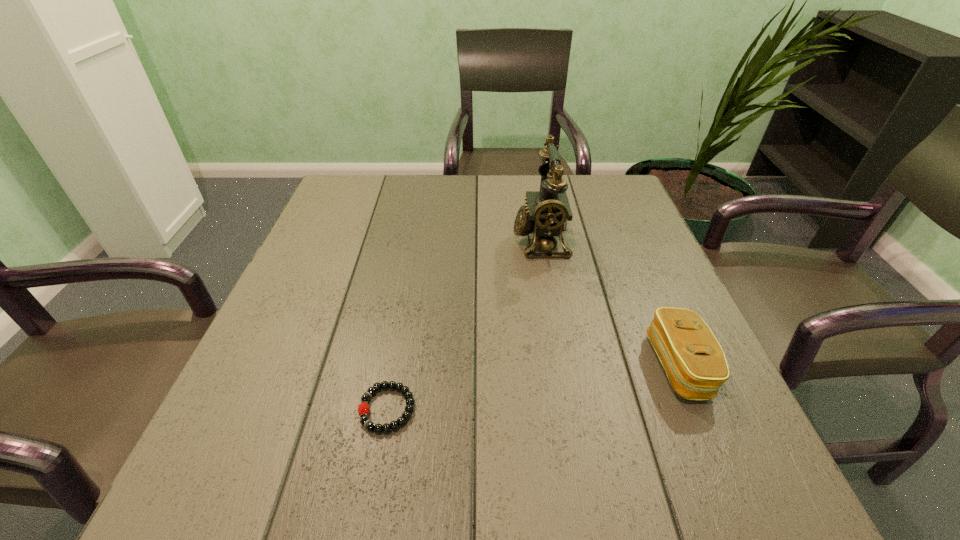
Where is `the farthest object`? the farthest object is located at coordinates (547, 212).

Find the location of `the second object from right to left`. the second object from right to left is located at coordinates (547, 212).

The image size is (960, 540). In order to click on the rightmost object in this screenshot , I will do `click(694, 361)`.

Locate an element on the screen. The height and width of the screenshot is (540, 960). clutch bag is located at coordinates (694, 361).

At what (x,y) coordinates should I click in order to perform the action: click on the leftmost object. Please return your answer as a coordinate pair (x, y). Looking at the image, I should click on (363, 409).

Where is `the shortest object`? This screenshot has width=960, height=540. the shortest object is located at coordinates (363, 409).

This screenshot has width=960, height=540. What are the coordinates of `free space located 0.340m on the rotary dial of the farthest object` in the screenshot? It's located at (372, 240).

At what (x,y) coordinates should I click in order to perform the action: click on free location located 0.390m on the rotary dial of the farthest object. Please return your answer as a coordinate pair (x, y). Looking at the image, I should click on (350, 240).

At what (x,y) coordinates should I click in order to perform the action: click on vacant space located on the rotary dial of the farthest object. Please return your answer as a coordinate pair (x, y). Looking at the image, I should click on (368, 240).

Locate an element on the screen. The image size is (960, 540). free space located on the zipper side of the clutch bag is located at coordinates (427, 366).